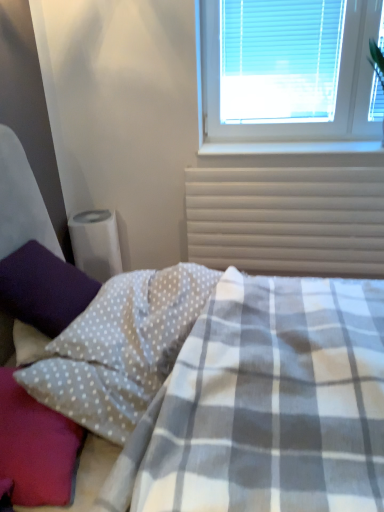
This screenshot has height=512, width=384. In order to click on free space above white dotted fabric pillow at lower left, the second pillow positioned from the left (from a real-world perspective) in this screenshot , I will do `click(33, 402)`.